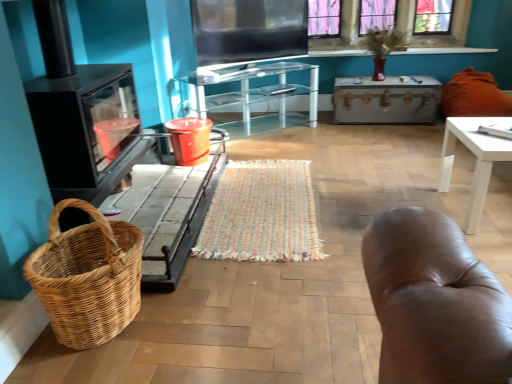
Question: Considering the relative sizes of white glossy table at right and flat matte screen at upper center in the image provided, is white glossy table at right smaller than flat matte screen at upper center?

Choices:
 (A) yes
 (B) no

Answer: (A)

Question: Considering the relative sizes of white glossy table at right and flat matte screen at upper center in the image provided, is white glossy table at right taller than flat matte screen at upper center?

Choices:
 (A) no
 (B) yes

Answer: (A)

Question: Is white glossy table at right positioned with its back to flat matte screen at upper center?

Choices:
 (A) yes
 (B) no

Answer: (B)

Question: Are white glossy table at right and flat matte screen at upper center making contact?

Choices:
 (A) yes
 (B) no

Answer: (B)

Question: Is white glossy table at right further to the viewer compared to flat matte screen at upper center?

Choices:
 (A) no
 (B) yes

Answer: (A)

Question: Considering the relative positions of white glossy table at right and flat matte screen at upper center in the image provided, is white glossy table at right to the right of flat matte screen at upper center from the viewer's perspective?

Choices:
 (A) no
 (B) yes

Answer: (B)

Question: Does flat matte screen at upper center have a larger size compared to white glossy table at right?

Choices:
 (A) yes
 (B) no

Answer: (A)

Question: Can you confirm if flat matte screen at upper center is wider than white glossy table at right?

Choices:
 (A) yes
 (B) no

Answer: (B)

Question: From a real-world perspective, is flat matte screen at upper center over white glossy table at right?

Choices:
 (A) yes
 (B) no

Answer: (A)

Question: Is flat matte screen at upper center far from white glossy table at right?

Choices:
 (A) yes
 (B) no

Answer: (A)

Question: Can you confirm if flat matte screen at upper center is thinner than white glossy table at right?

Choices:
 (A) no
 (B) yes

Answer: (B)

Question: Is the position of flat matte screen at upper center more distant than that of white glossy table at right?

Choices:
 (A) yes
 (B) no

Answer: (A)

Question: From the image's perspective, is pink glass window at upper center located beneath transparent glass cabinet at center?

Choices:
 (A) yes
 (B) no

Answer: (B)